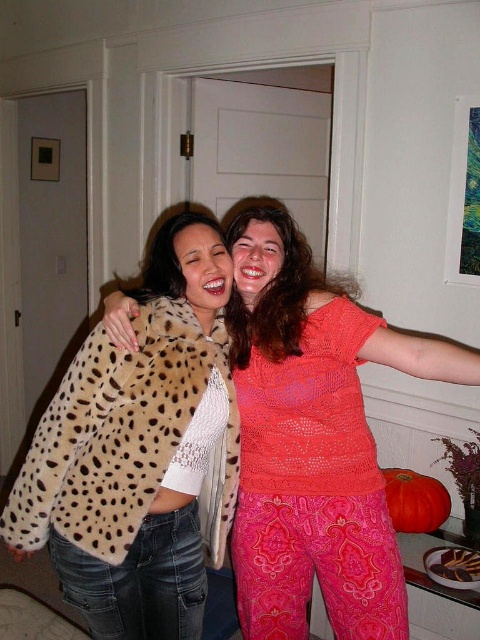
You are organizing a clothing store and need to arrange the spotted fur coat at center and the cheetah print coat at center on a rack. According to the image, which coat should be placed to the left side of the rack?

The spotted fur coat at center should be placed to the left side of the rack because in the image, the spotted fur coat at center is to the left of the cheetah print coat at center.

From the picture: You are an interior designer arranging a coat rack in a room. You have two coats to hang, the spotted fur coat at center and the cheetah print coat at center. Based on their positions in the image, which coat should you place higher on the rack?

The spotted fur coat at center should be placed higher on the rack because it is located above the cheetah print coat at center in the image.